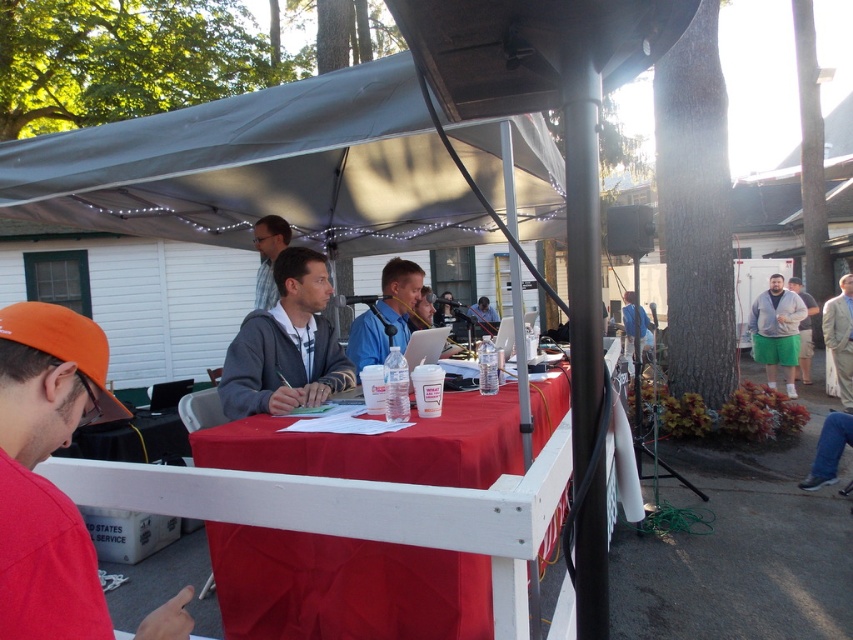
You are at the outdoor event and see the blue fabric shirt at center and the green cotton shorts at right. Which clothing item is positioned higher in the image?

The blue fabric shirt at center is positioned higher than the green cotton shorts at right in the image.